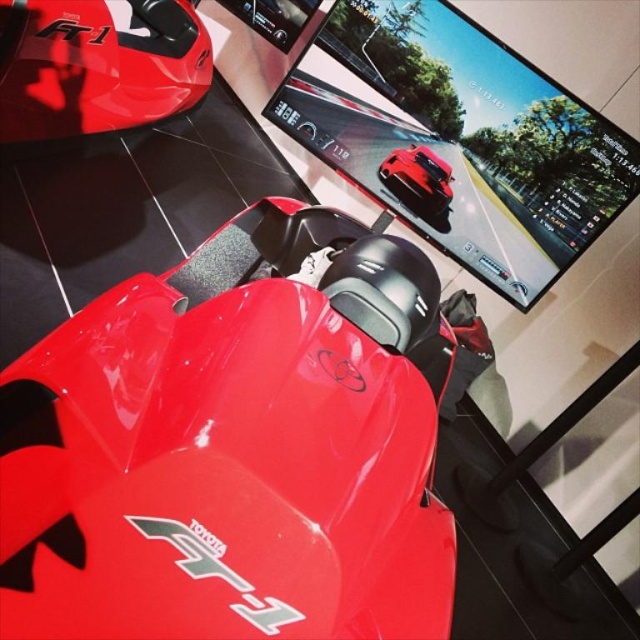
You are standing in the showroom and want to know the exact location of the glossy plastic monitor at upper center. What are its coordinates?

The glossy plastic monitor at upper center is located at coordinates point (461, 136).

You are standing in a showroom and want to check the distance between you and the glossy plastic monitor at upper center. Can you reach it without moving your feet?

The glossy plastic monitor at upper center is 1.98 meters away from the viewer, so you can reach it without moving your feet as it is within arm reach.